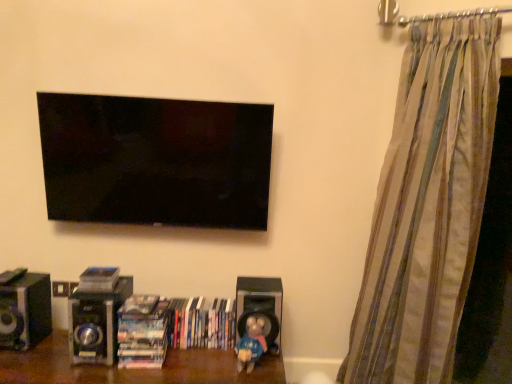
This screenshot has height=384, width=512. Find the location of `free point to the left of blue matte toy at lower center`. free point to the left of blue matte toy at lower center is located at coordinates (214, 352).